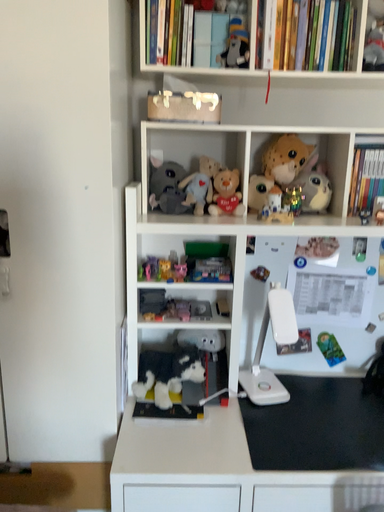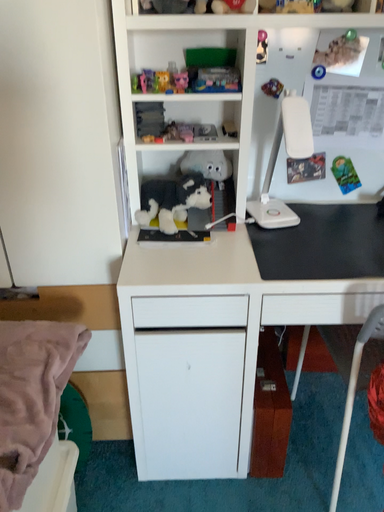
Question: Which way did the camera rotate in the video?

Choices:
 (A) rotated downward
 (B) rotated upward

Answer: (A)